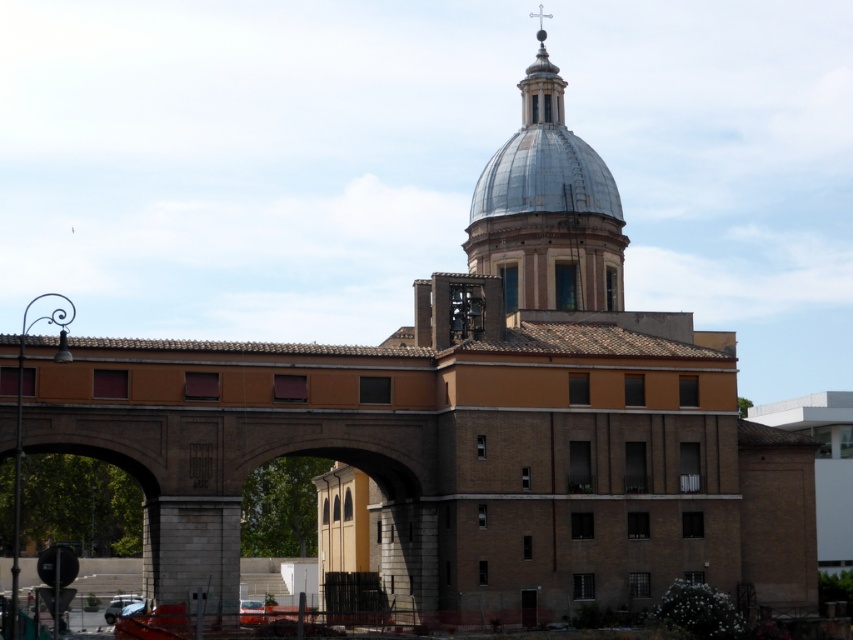
In the scene shown: You are standing in front of the building and notice two points marked on its facade. The first point is at coordinates point (509, 298) and the second is at point (492, 188). Which of these two points is closer to your current position?

Point (509, 298) is closer to the camera than point (492, 188), so the first point is closer to your current position.

You are an architect reviewing the building plans. The shiny silver dome at upper center and the shiny metallic dome at upper center are both part of the design. Which dome should be adjusted to ensure they are the same size?

The shiny metallic dome at upper center should be adjusted to match the size of the shiny silver dome at upper center since the shiny silver dome at upper center is bigger than the shiny metallic dome at upper center.

Based on the scene description, which dome is positioned lower in the image, the shiny silver dome at upper center or the shiny metallic dome at upper center?

The shiny silver dome at upper center is positioned below the shiny metallic dome at upper center, so it is lower in the image.